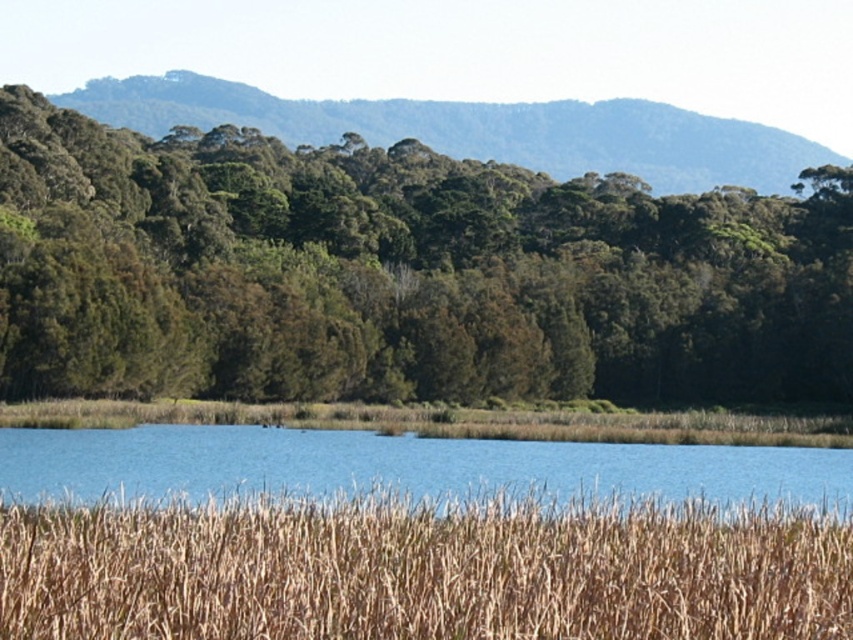
Question: Can you confirm if green leafy trees at center is positioned below blue water at center?

Choices:
 (A) no
 (B) yes

Answer: (A)

Question: Which point appears closest to the camera in this image?

Choices:
 (A) (42, 448)
 (B) (85, 538)
 (C) (41, 272)

Answer: (B)

Question: Among these objects, which one is nearest to the camera?

Choices:
 (A) green leafy trees at center
 (B) blue water at center

Answer: (B)

Question: Is green leafy trees at center to the left of blue water at center from the viewer's perspective?

Choices:
 (A) no
 (B) yes

Answer: (A)

Question: Which point is closer to the camera?

Choices:
 (A) dry grass at lower center
 (B) blue water at center
 (C) green leafy trees at center

Answer: (A)

Question: Can you confirm if green leafy trees at center is wider than dry grass at lower center?

Choices:
 (A) no
 (B) yes

Answer: (B)